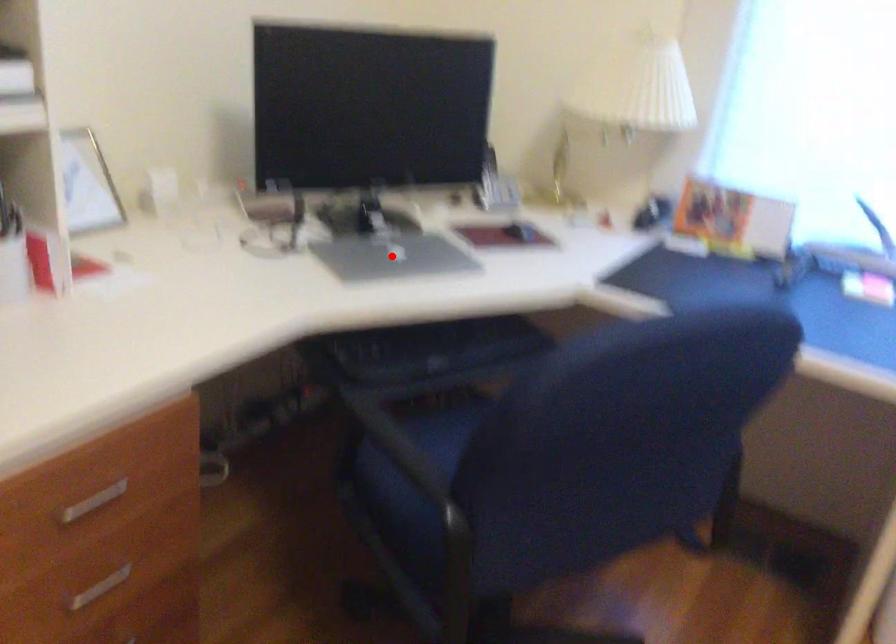
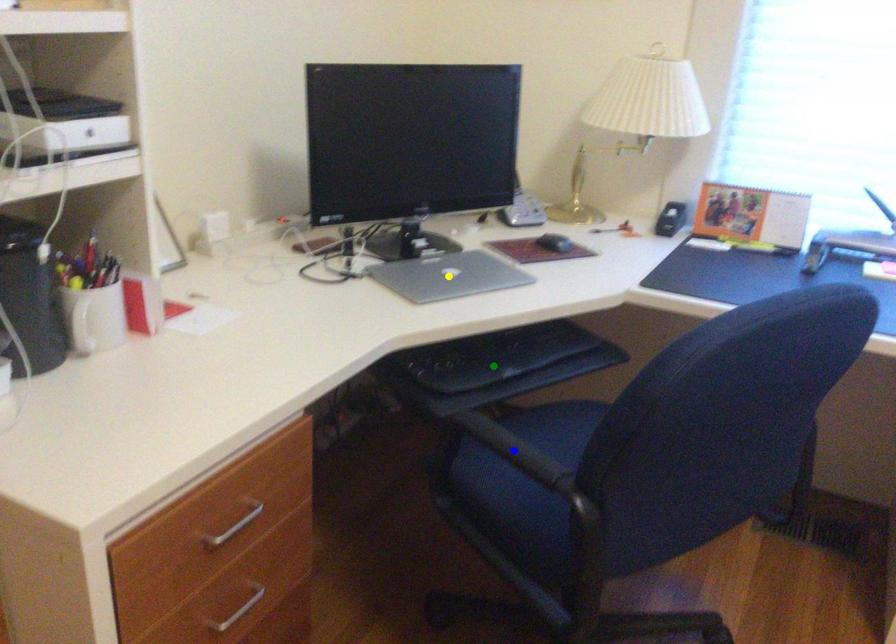
Question: I am providing you with two images of the same scene from different viewpoints. A red point is marked on the first image. You are given multiple points on the second image. Which mark in image 2 goes with the point in image 1?

Choices:
 (A) yellow point
 (B) green point
 (C) blue point

Answer: (A)